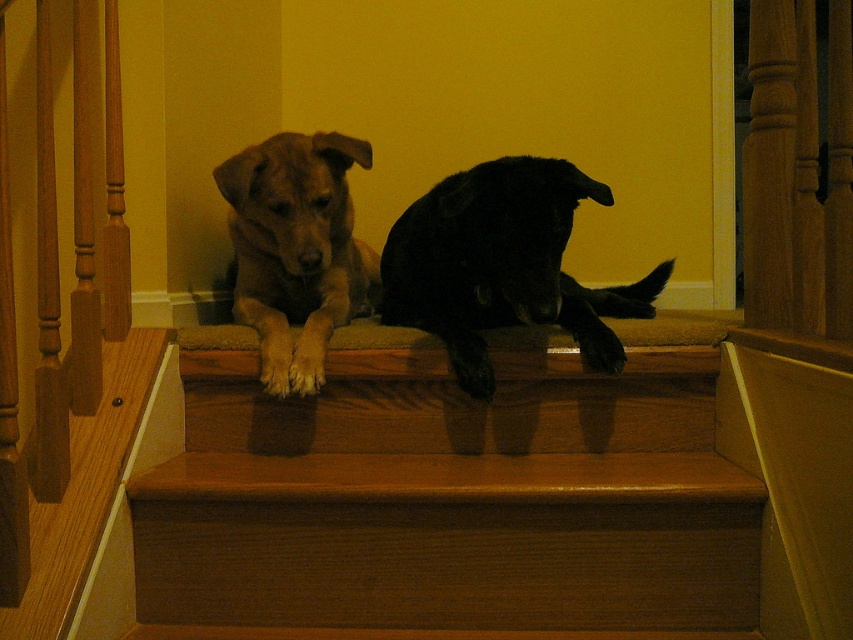
You are a dog trainer observing the two dogs on the staircase landing. You notice the black matte dog at center and the black matte paw at center. Which one is taller?

The black matte dog at center is taller than the black matte paw at center.

You are a dog owner who wants to ensure both dogs have enough space to move comfortably. Given that the black matte dog at center is in front of the black matte paw at center, which dog is closer to you, the observer?

The black matte dog at center is closer to you because it is positioned in front of the black matte paw at center, which is behind it.